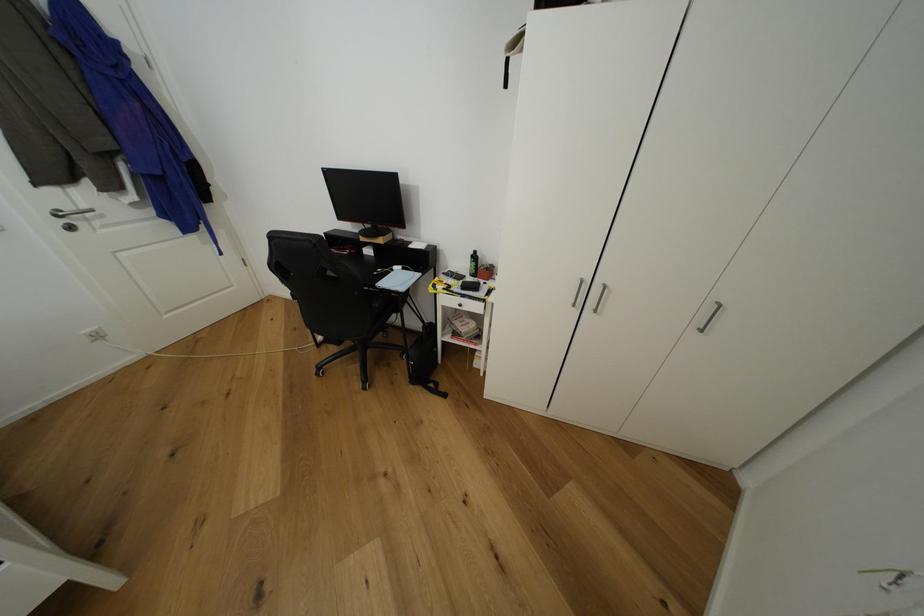
Where would you pull the silver door handle? Please return your answer as a coordinate pair (x, y).

(710, 317)